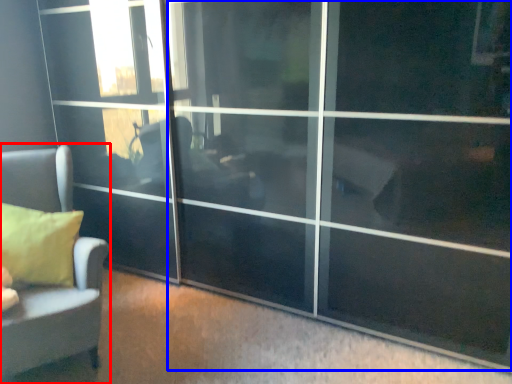
Question: Which object is closer to the camera taking this photo, furniture (highlighted by a red box) or screen door (highlighted by a blue box)?

Choices:
 (A) furniture
 (B) screen door

Answer: (B)